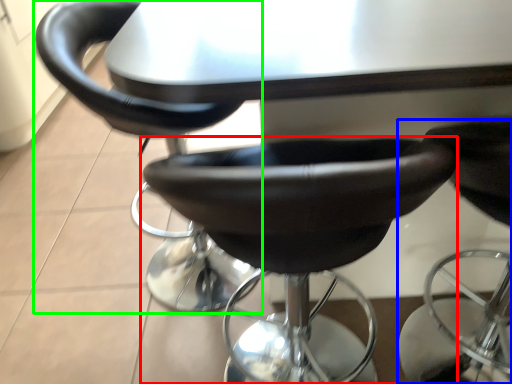
Question: Estimate the real-world distances between objects in this image. Which object is farther from chair (highlighted by a red box), chair (highlighted by a blue box) or chair (highlighted by a green box)?

Choices:
 (A) chair
 (B) chair

Answer: (A)